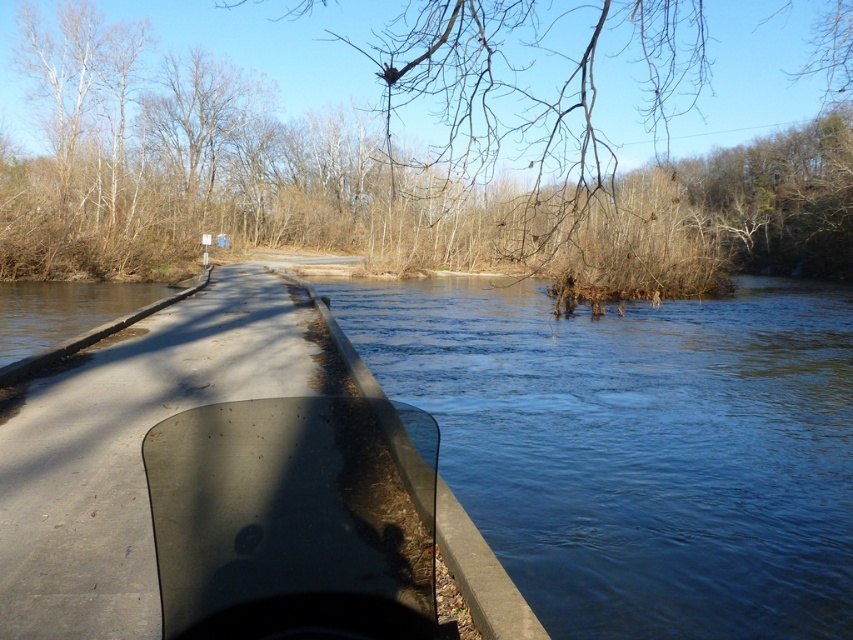
Question: Can you confirm if brown leafless branches at upper center is smaller than clear blue water at center?

Choices:
 (A) yes
 (B) no

Answer: (B)

Question: Which point is closer to the camera?

Choices:
 (A) 511,148
 (B) 3,512

Answer: (B)

Question: Estimate the real-world distances between objects in this image. Which object is closer to the brown leafless branches at upper center?

Choices:
 (A) transparent plastic boat at center
 (B) clear blue water at center

Answer: (B)

Question: Does clear blue water at center appear on the right side of transparent plastic boat at center?

Choices:
 (A) yes
 (B) no

Answer: (A)

Question: In this image, where is brown leafless branches at upper center located relative to transparent plastic boat at center?

Choices:
 (A) above
 (B) below

Answer: (A)

Question: Which object is closer to the camera taking this photo?

Choices:
 (A) transparent plastic boat at center
 (B) brown leafless branches at upper center

Answer: (A)